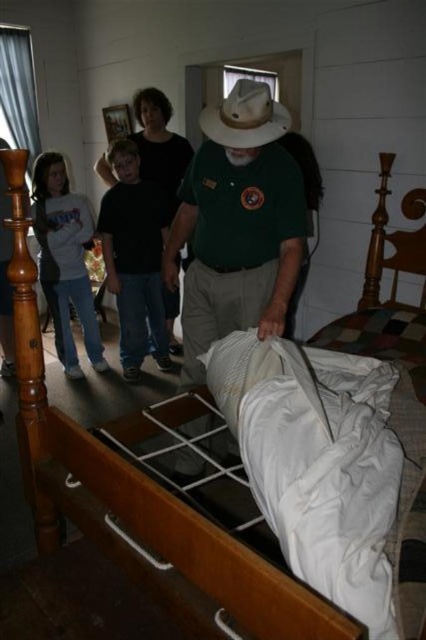
You are standing in the rustic room and want to move from point A to point B. Point A is located at coordinates point (x=155, y=324) and point B is at point (x=54, y=188). Which point is closer to you when you start?

Point A at coordinates point (x=155, y=324) is closer to you because it is further to the camera than point B at point (x=54, y=188), meaning it is physically nearer in the scene.

You are a tailor measuring clothes for two customers. The first customer is wearing a black cotton shirt at center, and the second is wearing a gray sweatshirt at left. Which garment has a greater width measurement?

The black cotton shirt at center has a greater width than the gray sweatshirt at left according to the description.